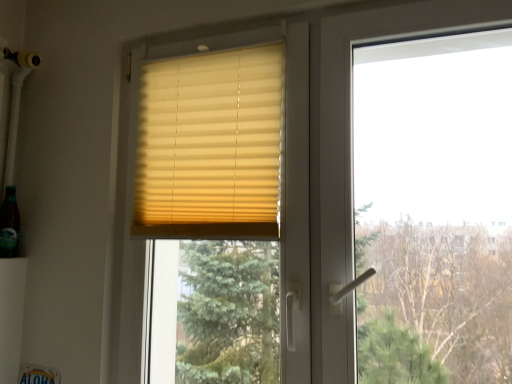
Image resolution: width=512 pixels, height=384 pixels. What do you see at coordinates (210, 146) in the screenshot? I see `beige fabric blinds at upper center` at bounding box center [210, 146].

Identify the location of beige fabric blinds at upper center. tap(210, 146).

The width and height of the screenshot is (512, 384). I want to click on translucent glass bottle at lower left, so click(x=9, y=224).

Describe the element at coordinates (9, 224) in the screenshot. I see `translucent glass bottle at lower left` at that location.

Where is `beige fabric blinds at upper center`? The image size is (512, 384). beige fabric blinds at upper center is located at coordinates (210, 146).

Which object is positioned more to the left, translucent glass bottle at lower left or beige fabric blinds at upper center?

From the viewer's perspective, translucent glass bottle at lower left appears more on the left side.

Based on the photo, considering the positions of objects translucent glass bottle at lower left and beige fabric blinds at upper center in the image provided, who is in front, translucent glass bottle at lower left or beige fabric blinds at upper center?

beige fabric blinds at upper center is closer to the camera.

Does point (0, 228) come closer to viewer compared to point (172, 229)?

No, (0, 228) is behind (172, 229).

From the image's perspective, which one is positioned lower, translucent glass bottle at lower left or beige fabric blinds at upper center?

translucent glass bottle at lower left is shown below in the image.

From a real-world perspective, is translucent glass bottle at lower left physically below beige fabric blinds at upper center?

Yes, from a real-world perspective, translucent glass bottle at lower left is under beige fabric blinds at upper center.

Between translucent glass bottle at lower left and beige fabric blinds at upper center, which one has larger width?

Wider between the two is translucent glass bottle at lower left.

Is translucent glass bottle at lower left shorter than beige fabric blinds at upper center?

Correct, translucent glass bottle at lower left is not as tall as beige fabric blinds at upper center.

Can you confirm if translucent glass bottle at lower left is bigger than beige fabric blinds at upper center?

No, translucent glass bottle at lower left is not bigger than beige fabric blinds at upper center.

Is translucent glass bottle at lower left completely or partially outside of beige fabric blinds at upper center?

translucent glass bottle at lower left is positioned outside beige fabric blinds at upper center.

Are translucent glass bottle at lower left and beige fabric blinds at upper center beside each other?

translucent glass bottle at lower left and beige fabric blinds at upper center are not in contact.

Is translucent glass bottle at lower left oriented towards beige fabric blinds at upper center?

Yes, translucent glass bottle at lower left faces towards beige fabric blinds at upper center.

Can you tell me how much translucent glass bottle at lower left and beige fabric blinds at upper center differ in facing direction?

They differ by 90 degrees in their facing directions.

The image size is (512, 384). What are the coordinates of `window blind on the right of translucent glass bottle at lower left` in the screenshot? It's located at (210, 146).

Is beige fabric blinds at upper center to the right of translucent glass bottle at lower left from the viewer's perspective?

Yes, beige fabric blinds at upper center is to the right of translucent glass bottle at lower left.

Is beige fabric blinds at upper center closer to camera compared to translucent glass bottle at lower left?

Yes, the depth of beige fabric blinds at upper center is less than that of translucent glass bottle at lower left.

Is point (223, 183) farther from viewer compared to point (4, 256)?

That is False.

From the image's perspective, which is below, beige fabric blinds at upper center or translucent glass bottle at lower left?

translucent glass bottle at lower left.

From a real-world perspective, is beige fabric blinds at upper center located beneath translucent glass bottle at lower left?

No, from a real-world perspective, beige fabric blinds at upper center is not beneath translucent glass bottle at lower left.

Is beige fabric blinds at upper center wider or thinner than translucent glass bottle at lower left?

Considering their sizes, beige fabric blinds at upper center looks slimmer than translucent glass bottle at lower left.

Between beige fabric blinds at upper center and translucent glass bottle at lower left, which one has less height?

Standing shorter between the two is translucent glass bottle at lower left.

Based on the photo, does beige fabric blinds at upper center have a larger size compared to translucent glass bottle at lower left?

Yes, beige fabric blinds at upper center is bigger than translucent glass bottle at lower left.

Which is correct: beige fabric blinds at upper center is inside translucent glass bottle at lower left, or outside of it?

beige fabric blinds at upper center is spatially situated outside translucent glass bottle at lower left.

Is beige fabric blinds at upper center positioned far away from translucent glass bottle at lower left?

No.

Is translucent glass bottle at lower left at the back of beige fabric blinds at upper center?

beige fabric blinds at upper center is not turned away from translucent glass bottle at lower left.

I want to click on window blind in front of the translucent glass bottle at lower left, so click(210, 146).

At what (x,y) coordinates should I click in order to perform the action: click on window blind above the translucent glass bottle at lower left (from the image's perspective). Please return your answer as a coordinate pair (x, y). The image size is (512, 384). Looking at the image, I should click on (210, 146).

The height and width of the screenshot is (384, 512). I want to click on champagne below the beige fabric blinds at upper center (from the image's perspective), so click(x=9, y=224).